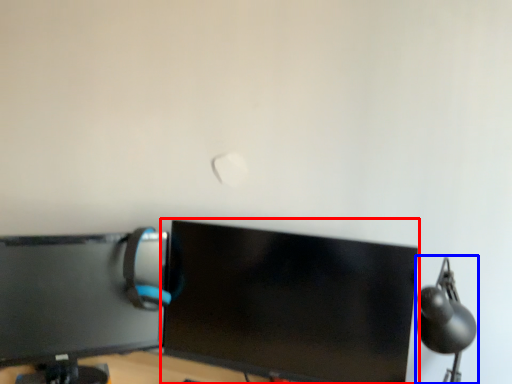
Question: Which object is closer to the camera taking this photo, computer monitor (highlighted by a red box) or table lamp (highlighted by a blue box)?

Choices:
 (A) computer monitor
 (B) table lamp

Answer: (B)